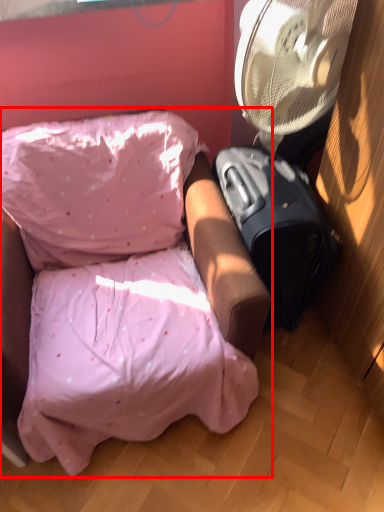
Question: Where is furniture (annotated by the red box) located in relation to luggage in the image?

Choices:
 (A) right
 (B) left

Answer: (B)